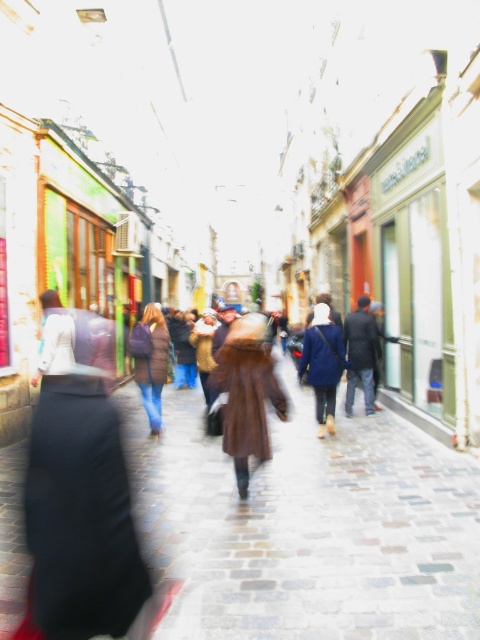
Question: In this image, where is brown leather coat at center located relative to brown fuzzy coat at center?

Choices:
 (A) left
 (B) right

Answer: (B)

Question: Which of the following is the closest to the observer?

Choices:
 (A) (156, 416)
 (B) (367, 401)

Answer: (A)

Question: Can you confirm if matte brown coat at center is positioned below brown fuzzy coat at center?

Choices:
 (A) no
 (B) yes

Answer: (A)

Question: Is cobblestone pavement at center to the right of brown fuzzy coat at center from the viewer's perspective?

Choices:
 (A) no
 (B) yes

Answer: (B)

Question: Which point is farther to the camera?

Choices:
 (A) (155, 307)
 (B) (305, 349)
 (C) (231, 589)

Answer: (A)

Question: Which of these objects is positioned closest to the cobblestone pavement at center?

Choices:
 (A) dark blue jeans at center
 (B) matte brown coat at center

Answer: (B)